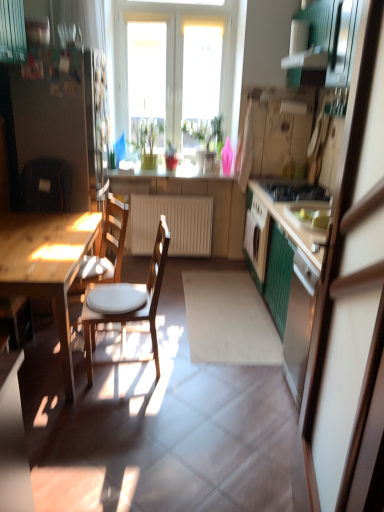
At what (x,y) coordinates should I click in order to perform the action: click on wooden chair with white cushion at left, placed as the 2th chair when sorted from back to front. Please return your answer as a coordinate pair (x, y). The image size is (384, 512). Looking at the image, I should click on (130, 315).

I want to click on green matte cabinet at right, so click(x=349, y=307).

This screenshot has width=384, height=512. What are the coordinates of `white matte radiator at center` in the screenshot? It's located at (172, 224).

What are the coordinates of `green wood cabinet at right` in the screenshot? It's located at click(291, 292).

The height and width of the screenshot is (512, 384). Find the location of `green matte plant at center, placed as the 1th houseplant when sorted from right to left`. green matte plant at center, placed as the 1th houseplant when sorted from right to left is located at coordinates (205, 133).

Can you confirm if white glossy exhaust hood at upper center is bigger than green glossy plant at center, which is the first houseplant from left to right?

Actually, white glossy exhaust hood at upper center might be smaller than green glossy plant at center, which is the first houseplant from left to right.

Is white glossy exhaust hood at upper center not inside green glossy plant at center, which is the first houseplant from left to right?

Yes, white glossy exhaust hood at upper center is not within green glossy plant at center, which is the first houseplant from left to right.

Measure the distance from white glossy exhaust hood at upper center to green glossy plant at center, which is the first houseplant from left to right.

white glossy exhaust hood at upper center and green glossy plant at center, which is the first houseplant from left to right, are 1.63 meters apart from each other.

Is white glossy exhaust hood at upper center touching green glossy plant at center, which is the first houseplant from left to right?

There is a gap between white glossy exhaust hood at upper center and green glossy plant at center, which is the first houseplant from left to right.

From the image's perspective, is wooden table at left below wooden chair at center, the second chair viewed from the front?

Yes, from the image's perspective, wooden table at left is beneath wooden chair at center, the second chair viewed from the front.

Is wooden table at left further to camera compared to wooden chair at center, the second chair viewed from the front?

No, it is not.

From a real-world perspective, which is physically above, wooden table at left or wooden chair at center, the 1th chair viewed from the back?

wooden chair at center, the 1th chair viewed from the back.

Is wooden table at left oriented away from wooden chair at center, the second chair viewed from the front?

Yes, wooden table at left's orientation is away from wooden chair at center, the second chair viewed from the front.

From a real-world perspective, between green glossy plant at center, which is the first houseplant from left to right, and green matte cabinet at right, who is vertically lower?

green matte cabinet at right.

Is the position of green glossy plant at center, which is the first houseplant from left to right, more distant than that of green matte cabinet at right?

Yes, green glossy plant at center, which is the first houseplant from left to right, is further from the viewer.

Does point (136, 137) come in front of point (362, 133)?

No, it is not.

From a real-world perspective, which object rests below the other?

black glossy gas stove at center right is physically lower.

Considering the sizes of objects green glossy plant at center, which is the first houseplant from left to right, and black glossy gas stove at center right in the image provided, who is shorter, green glossy plant at center, which is the first houseplant from left to right, or black glossy gas stove at center right?

black glossy gas stove at center right is shorter.

Is green glossy plant at center, the second houseplant viewed from the right, oriented away from black glossy gas stove at center right?

No, black glossy gas stove at center right is not at the back of green glossy plant at center, the second houseplant viewed from the right.

From the image's perspective, is green glossy plant at center, the second houseplant viewed from the right, under black glossy gas stove at center right?

No.

How far apart are green matte plant at center, placed as the 1th houseplant when sorted from right to left, and wooden chair at center, the 1th chair viewed from the back?

green matte plant at center, placed as the 1th houseplant when sorted from right to left, and wooden chair at center, the 1th chair viewed from the back, are 5.62 feet apart from each other.

From a real-world perspective, is green matte plant at center, the second houseplant in the left-to-right sequence, physically located above or below wooden chair at center, the 1th chair viewed from the back?

In terms of real-world spatial position, green matte plant at center, the second houseplant in the left-to-right sequence, is above wooden chair at center, the 1th chair viewed from the back.

Considering the positions of objects green matte plant at center, the second houseplant in the left-to-right sequence, and wooden chair at center, the 1th chair viewed from the back, in the image provided, who is behind, green matte plant at center, the second houseplant in the left-to-right sequence, or wooden chair at center, the 1th chair viewed from the back,?

green matte plant at center, the second houseplant in the left-to-right sequence.

Looking at this image, considering their positions, is wooden chair at center, the second chair viewed from the front, located in front of or behind green glossy plant at center, the second houseplant viewed from the right?

Clearly, wooden chair at center, the second chair viewed from the front, is in front of green glossy plant at center, the second houseplant viewed from the right.

How many degrees apart are the facing directions of wooden chair at center, the 1th chair viewed from the back, and green glossy plant at center, the second houseplant viewed from the right?

The facing directions of wooden chair at center, the 1th chair viewed from the back, and green glossy plant at center, the second houseplant viewed from the right, are 62.8 degrees apart.

You are a GUI agent. You are given a task and a screenshot of the screen. Output one action in this format:
    pyautogui.click(x=<x>, y=<y>)
    Task: Click on the 1st houseplant to the right of the wooden chair at center, the second chair viewed from the front, counting from the anchor's position
    
    Given the screenshot: What is the action you would take?
    pyautogui.click(x=146, y=139)

Considering the positions of point (72, 286) and point (136, 141), is point (72, 286) closer or farther from the camera than point (136, 141)?

Point (72, 286).

From a real-world perspective, who is located lower, white glossy exhaust hood at upper center or matte white countertop at center?

matte white countertop at center.

Would you say white glossy exhaust hood at upper center is inside or outside matte white countertop at center?

white glossy exhaust hood at upper center is outside matte white countertop at center.

Does white glossy exhaust hood at upper center turn towards matte white countertop at center?

No, white glossy exhaust hood at upper center is not oriented towards matte white countertop at center.

I want to click on countertop below the white glossy exhaust hood at upper center (from the image's perspective), so click(168, 173).

This screenshot has width=384, height=512. In order to click on exhaust hood above the green glossy plant at center, the second houseplant viewed from the right (from the image's perspective) in this screenshot , I will do `click(306, 60)`.

From the wooden table at left, count 2nd chairs backward and point to it. Please provide its 2D coordinates.

[(107, 248)]

When comparing their distances from black glossy gas stove at center right, does green matte cabinet at right or white glossy exhaust hood at upper center seem closer?

white glossy exhaust hood at upper center.

Estimate the real-world distances between objects in this image. Which object is further from white matte radiator at center, matte white countertop at center or wooden table at left?

Based on the image, wooden table at left appears to be further to white matte radiator at center.

When comparing their distances from wooden chair with white cushion at left, acting as the first chair starting from the front, does white matte radiator at center or green wood cabinet at right seem closer?

green wood cabinet at right.

Based on their spatial positions, is green glossy plant at center, the second houseplant viewed from the right, or green wood cabinet at right closer to matte white countertop at center?

green glossy plant at center, the second houseplant viewed from the right, is closer to matte white countertop at center.

Considering their positions, is white matte radiator at center positioned further to wooden chair at center, the second chair viewed from the front, than green wood cabinet at right?

Among the two, green wood cabinet at right is located further to wooden chair at center, the second chair viewed from the front.

Which object lies nearer to the anchor point matte white countertop at center, wooden chair at center, the second chair viewed from the front, or green matte plant at center, placed as the 1th houseplant when sorted from right to left?

Among the two, green matte plant at center, placed as the 1th houseplant when sorted from right to left, is located nearer to matte white countertop at center.

Estimate the real-world distances between objects in this image. Which object is closer to green wood cabinet at right, black glossy gas stove at center right or wooden table at left?

black glossy gas stove at center right.

Estimate the real-world distances between objects in this image. Which object is closer to green matte plant at center, the second houseplant in the left-to-right sequence, wooden chair with white cushion at left, placed as the 2th chair when sorted from back to front, or black glossy gas stove at center right?

black glossy gas stove at center right is closer to green matte plant at center, the second houseplant in the left-to-right sequence.

Image resolution: width=384 pixels, height=512 pixels. Find the location of `cabinetry that lies between transparent glass window at center and wooden chair with white cushion at left, placed as the 2th chair when sorted from back to front, from top to bottom`. cabinetry that lies between transparent glass window at center and wooden chair with white cushion at left, placed as the 2th chair when sorted from back to front, from top to bottom is located at coordinates (291, 292).

Image resolution: width=384 pixels, height=512 pixels. What are the coordinates of `exhaust hood between wooden chair with white cushion at left, acting as the first chair starting from the front, and green glossy plant at center, which is the first houseplant from left to right, in the front-back direction` in the screenshot? It's located at (306, 60).

The height and width of the screenshot is (512, 384). I want to click on table positioned between green matte cabinet at right and wooden chair with white cushion at left, acting as the first chair starting from the front, from near to far, so click(x=47, y=264).

The height and width of the screenshot is (512, 384). What are the coordinates of `houseplant between green matte cabinet at right and transparent glass window at center in the front-back direction` in the screenshot? It's located at (205, 133).